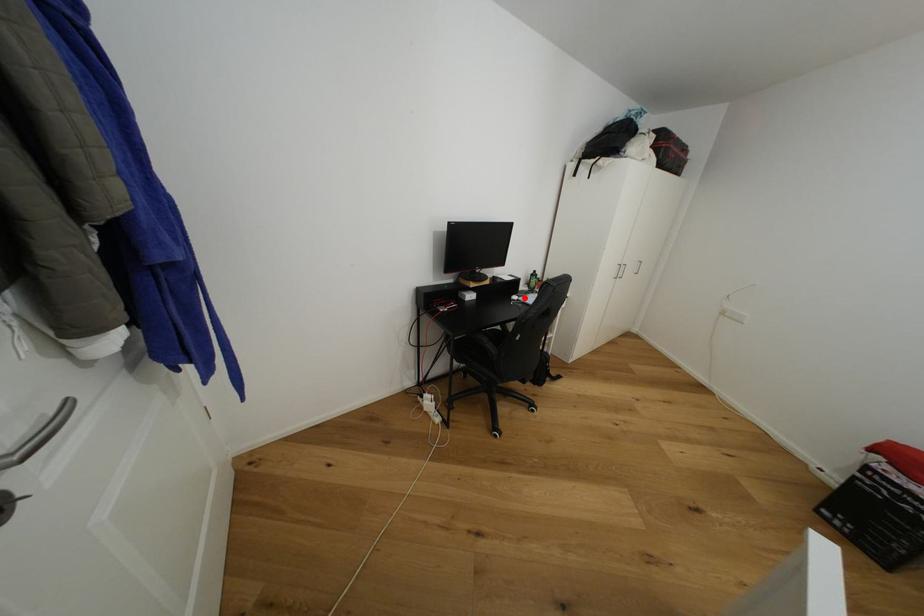
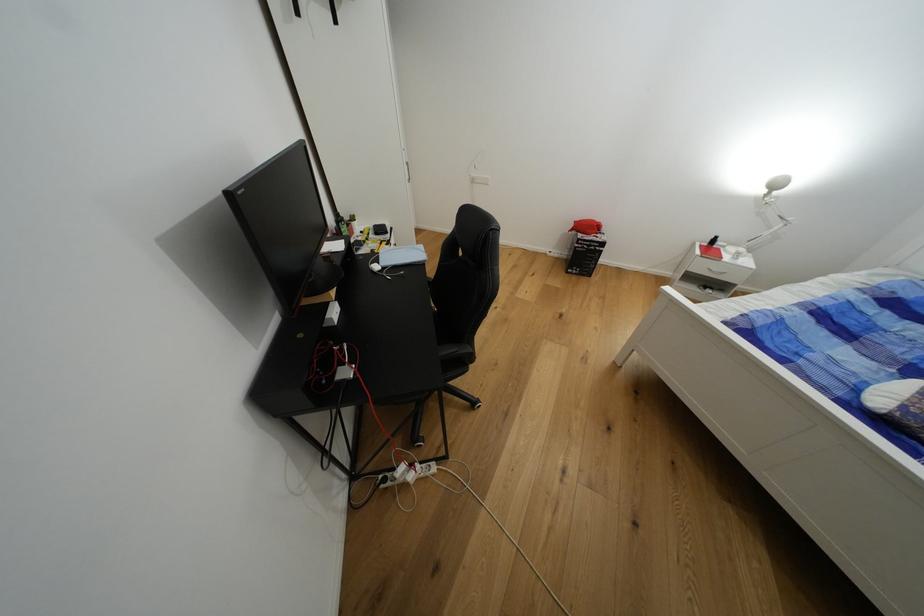
Where in the second image is the point corresponding to the highlighted location from the first image?

(383, 262)